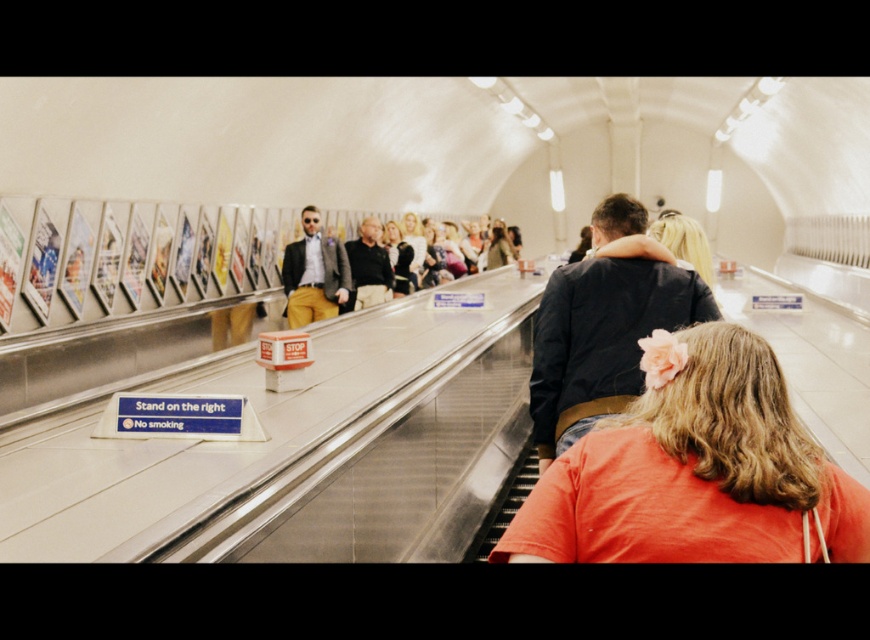
Which is in front, point (607, 227) or point (676, 248)?

Positioned in front is point (607, 227).

Can you confirm if dark blue jacket at center is bigger than blonde hair at upper center?

No, dark blue jacket at center is not bigger than blonde hair at upper center.

Image resolution: width=870 pixels, height=640 pixels. Describe the element at coordinates (603, 326) in the screenshot. I see `dark blue jacket at center` at that location.

Find the location of `dark blue jacket at center`. dark blue jacket at center is located at coordinates (603, 326).

In the scene shown: Does blonde hair at upper center lie behind matte black jacket at center?

No, it is in front of matte black jacket at center.

Where is `blonde hair at upper center`? blonde hair at upper center is located at coordinates (683, 241).

Does orange cotton shirt at center lie behind blonde hair at upper center?

That is False.

Is point (571, 464) positioned in front of point (684, 237)?

Yes, it is in front of point (684, 237).

Who is more distant from viewer, [667,467] or [693,262]?

The point [693,262] is more distant.

Locate an element on the screen. This screenshot has height=640, width=870. orange cotton shirt at center is located at coordinates pyautogui.click(x=696, y=472).